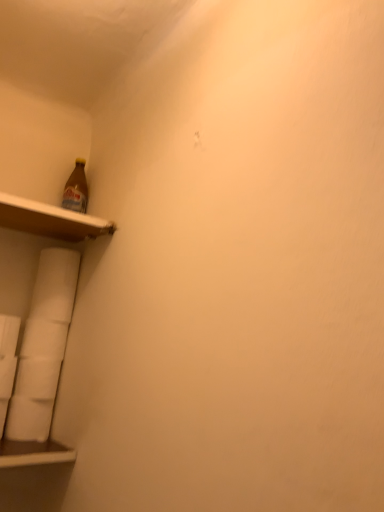
At what (x,y) coordinates should I click in order to perform the action: click on white matte toilet paper at lower left, the fourth toilet paper from the bottom. Please return your answer as a coordinate pair (x, y). Looking at the image, I should click on [55, 285].

Describe the element at coordinates (37, 378) in the screenshot. I see `white matte toilet paper at lower left, the 3th toilet paper when ordered from top to bottom` at that location.

The image size is (384, 512). What do you see at coordinates (50, 220) in the screenshot?
I see `wooden shelf at upper left` at bounding box center [50, 220].

At what (x,y) coordinates should I click in order to perform the action: click on white matte toilet paper at lower left, placed as the 1th toilet paper when sorted from top to bottom. Please return your answer as a coordinate pair (x, y). This screenshot has width=384, height=512. Looking at the image, I should click on (55, 285).

From a real-world perspective, starting from the white matte toilet paper at lower left, the fourth toilet paper from the bottom, which toilet paper is the 2nd one below it? Please provide its 2D coordinates.

[(37, 378)]

Is point (42, 365) more distant than point (65, 289)?

No, (42, 365) is closer to viewer.

From a real-world perspective, which object stands above the other?

From a 3D spatial view, white matte toilet paper at lower left, placed as the 1th toilet paper when sorted from top to bottom, is above.

Which is more to the left, white matte toilet paper at lower left, which is the 2th toilet paper from bottom to top, or white matte toilet paper at lower left, placed as the 1th toilet paper when sorted from top to bottom?

Positioned to the left is white matte toilet paper at lower left, which is the 2th toilet paper from bottom to top.

Measure the distance between white matte toilet paper at lower left, placed as the 1th toilet paper when sorted from top to bottom, and white matte toilet paper at lower left, which is the 2th toilet paper from bottom to top.

white matte toilet paper at lower left, placed as the 1th toilet paper when sorted from top to bottom, and white matte toilet paper at lower left, which is the 2th toilet paper from bottom to top, are 6.92 inches apart from each other.

From a real-world perspective, which is physically above, white matte toilet paper at lower left, the fourth toilet paper from the bottom, or white matte toilet paper at lower left, which is the 2th toilet paper from bottom to top?

white matte toilet paper at lower left, the fourth toilet paper from the bottom, from a real-world perspective.

Is white matte toilet paper at lower left, placed as the 1th toilet paper when sorted from top to bottom, bigger or smaller than white matte toilet paper at lower left, the 3th toilet paper when ordered from top to bottom?

Clearly, white matte toilet paper at lower left, placed as the 1th toilet paper when sorted from top to bottom, is smaller in size than white matte toilet paper at lower left, the 3th toilet paper when ordered from top to bottom.

What's the angular difference between white matte toilet paper at lower left, the fourth toilet paper from the bottom, and white matte toilet paper at lower left, the 3th toilet paper when ordered from top to bottom,'s facing directions?

There is a 2.45-degree angle between the facing directions of white matte toilet paper at lower left, the fourth toilet paper from the bottom, and white matte toilet paper at lower left, the 3th toilet paper when ordered from top to bottom.

Which point is more forward, [74,213] or [42,376]?

The point [42,376] is closer to the camera.

Is wooden shelf at upper left oriented towards white matte toilet paper at lower left, the 3th toilet paper when ordered from top to bottom?

No, wooden shelf at upper left is not facing towards white matte toilet paper at lower left, the 3th toilet paper when ordered from top to bottom.

Which is in front, wooden shelf at upper left or white matte toilet paper at lower left, which is the 2th toilet paper from bottom to top?

wooden shelf at upper left is more forward.

How many degrees apart are the facing directions of wooden shelf at upper left and white matte toilet paper at lower left, the 3th toilet paper when ordered from top to bottom?

wooden shelf at upper left and white matte toilet paper at lower left, the 3th toilet paper when ordered from top to bottom, are facing 0.179 degrees away from each other.

Considering the sizes of objects white matte toilet paper at lower left, the second toilet paper positioned from the top, and white matte toilet paper at lower left, the 3th toilet paper when ordered from top to bottom, in the image provided, who is bigger, white matte toilet paper at lower left, the second toilet paper positioned from the top, or white matte toilet paper at lower left, the 3th toilet paper when ordered from top to bottom,?

white matte toilet paper at lower left, the 3th toilet paper when ordered from top to bottom, is bigger.

Is white matte toilet paper at lower left, which is the 2th toilet paper from bottom to top, at the back of white matte toilet paper at lower left, which appears as the third toilet paper when ordered from the bottom?

white matte toilet paper at lower left, which appears as the third toilet paper when ordered from the bottom, does not have its back to white matte toilet paper at lower left, which is the 2th toilet paper from bottom to top.

Find the location of a particular element. The image size is (384, 512). the 1st toilet paper directly above the white matte toilet paper at lower left, which is the 2th toilet paper from bottom to top (from a real-world perspective) is located at coordinates (44, 339).

Between white matte toilet paper at lower left, which appears as the third toilet paper when ordered from the bottom, and white matte toilet paper at lower left, the 1th toilet paper positioned from the bottom, which one appears on the right side from the viewer's perspective?

white matte toilet paper at lower left, which appears as the third toilet paper when ordered from the bottom.

Is white matte toilet paper at lower left, which appears as the third toilet paper when ordered from the bottom, taller or shorter than white matte toilet paper at lower left, the 1th toilet paper positioned from the bottom?

In the image, white matte toilet paper at lower left, which appears as the third toilet paper when ordered from the bottom, appears to be shorter than white matte toilet paper at lower left, the 1th toilet paper positioned from the bottom.

In terms of size, does white matte toilet paper at lower left, which appears as the third toilet paper when ordered from the bottom, appear bigger or smaller than white matte toilet paper at lower left, the 1th toilet paper positioned from the bottom?

In the image, white matte toilet paper at lower left, which appears as the third toilet paper when ordered from the bottom, appears to be smaller than white matte toilet paper at lower left, the 1th toilet paper positioned from the bottom.

From the image's perspective, between white matte toilet paper at lower left, the second toilet paper positioned from the top, and white matte toilet paper at lower left, the fourth toilet paper in the top-to-bottom sequence, who is located below?

From the image's view, white matte toilet paper at lower left, the fourth toilet paper in the top-to-bottom sequence, is below.

From a real-world perspective, does white matte toilet paper at lower left, which is the 2th toilet paper from bottom to top, stand above wooden shelf at upper left?

No, from a real-world perspective, white matte toilet paper at lower left, which is the 2th toilet paper from bottom to top, is not over wooden shelf at upper left

Which of these two, white matte toilet paper at lower left, the 3th toilet paper when ordered from top to bottom, or wooden shelf at upper left, stands shorter?

Standing shorter between the two is wooden shelf at upper left.

In terms of width, does white matte toilet paper at lower left, which is the 2th toilet paper from bottom to top, look wider or thinner when compared to wooden shelf at upper left?

Considering their sizes, white matte toilet paper at lower left, which is the 2th toilet paper from bottom to top, looks slimmer than wooden shelf at upper left.

Is white matte toilet paper at lower left, the 3th toilet paper when ordered from top to bottom, not within wooden shelf at upper left?

Indeed, white matte toilet paper at lower left, the 3th toilet paper when ordered from top to bottom, is completely outside wooden shelf at upper left.

From the image's perspective, is white matte toilet paper at lower left, which appears as the third toilet paper when ordered from the bottom, located beneath wooden shelf at upper left?

Correct, white matte toilet paper at lower left, which appears as the third toilet paper when ordered from the bottom, appears lower than wooden shelf at upper left in the image.

Which object is wider, white matte toilet paper at lower left, which appears as the third toilet paper when ordered from the bottom, or wooden shelf at upper left?

With larger width is wooden shelf at upper left.

Which object is further away from the camera taking this photo, white matte toilet paper at lower left, the second toilet paper positioned from the top, or wooden shelf at upper left?

white matte toilet paper at lower left, the second toilet paper positioned from the top, is behind.

The height and width of the screenshot is (512, 384). Identify the location of the 2nd toilet paper counting from the right of the white matte toilet paper at lower left, the 3th toilet paper when ordered from top to bottom. (55, 285).

Starting from the white matte toilet paper at lower left, placed as the 1th toilet paper when sorted from top to bottom, which toilet paper is the 2nd one in front? Please provide its 2D coordinates.

[(37, 378)]

Based on their spatial positions, is white matte toilet paper at lower left, placed as the 1th toilet paper when sorted from top to bottom, or white matte toilet paper at lower left, which is the 2th toilet paper from bottom to top, further from wooden shelf at upper left?

white matte toilet paper at lower left, which is the 2th toilet paper from bottom to top, lies further to wooden shelf at upper left than the other object.

Looking at this image, which object lies further to the anchor point white matte toilet paper at lower left, the second toilet paper positioned from the top, white matte toilet paper at lower left, the fourth toilet paper in the top-to-bottom sequence, or white matte toilet paper at lower left, the 3th toilet paper when ordered from top to bottom?

Among the two, white matte toilet paper at lower left, the fourth toilet paper in the top-to-bottom sequence, is located further to white matte toilet paper at lower left, the second toilet paper positioned from the top.

Estimate the real-world distances between objects in this image. Which object is closer to white matte toilet paper at lower left, the 3th toilet paper when ordered from top to bottom, white matte toilet paper at lower left, the fourth toilet paper from the bottom, or white matte toilet paper at lower left, which appears as the third toilet paper when ordered from the bottom?

The object closer to white matte toilet paper at lower left, the 3th toilet paper when ordered from top to bottom, is white matte toilet paper at lower left, which appears as the third toilet paper when ordered from the bottom.

From the image, which object appears to be farther from white matte toilet paper at lower left, the fourth toilet paper in the top-to-bottom sequence, wooden shelf at upper left or white matte toilet paper at lower left, which appears as the third toilet paper when ordered from the bottom?

wooden shelf at upper left.

Based on their spatial positions, is white matte toilet paper at lower left, placed as the 1th toilet paper when sorted from top to bottom, or white matte toilet paper at lower left, the 3th toilet paper when ordered from top to bottom, closer to white matte toilet paper at lower left, the second toilet paper positioned from the top?

white matte toilet paper at lower left, the 3th toilet paper when ordered from top to bottom, is closer to white matte toilet paper at lower left, the second toilet paper positioned from the top.

Estimate the real-world distances between objects in this image. Which object is further from wooden shelf at upper left, white matte toilet paper at lower left, the second toilet paper positioned from the top, or white matte toilet paper at lower left, the fourth toilet paper in the top-to-bottom sequence?

The object further to wooden shelf at upper left is white matte toilet paper at lower left, the fourth toilet paper in the top-to-bottom sequence.

From the image, which object appears to be nearer to wooden shelf at upper left, white matte toilet paper at lower left, the fourth toilet paper in the top-to-bottom sequence, or white matte toilet paper at lower left, the fourth toilet paper from the bottom?

white matte toilet paper at lower left, the fourth toilet paper from the bottom, is closer to wooden shelf at upper left.

Which object lies further to the anchor point white matte toilet paper at lower left, the fourth toilet paper in the top-to-bottom sequence, white matte toilet paper at lower left, the second toilet paper positioned from the top, or white matte toilet paper at lower left, which is the 2th toilet paper from bottom to top?

The object further to white matte toilet paper at lower left, the fourth toilet paper in the top-to-bottom sequence, is white matte toilet paper at lower left, the second toilet paper positioned from the top.

Identify the location of toilet paper that lies between wooden shelf at upper left and white matte toilet paper at lower left, the second toilet paper positioned from the top, from top to bottom. The width and height of the screenshot is (384, 512). (55, 285).

Locate an element on the screen. Image resolution: width=384 pixels, height=512 pixels. toilet paper between white matte toilet paper at lower left, the fourth toilet paper from the bottom, and white matte toilet paper at lower left, the 3th toilet paper when ordered from top to bottom, vertically is located at coordinates (44, 339).

You are a GUI agent. You are given a task and a screenshot of the screen. Output one action in this format:
    pyautogui.click(x=<x>, y=<y>)
    Task: Click on the toilet paper that lies between white matte toilet paper at lower left, which appears as the third toilet paper when ordered from the bottom, and white matte toilet paper at lower left, the 1th toilet paper positioned from the bottom, from top to bottom
    The height and width of the screenshot is (512, 384).
    Given the screenshot: What is the action you would take?
    pyautogui.click(x=37, y=378)